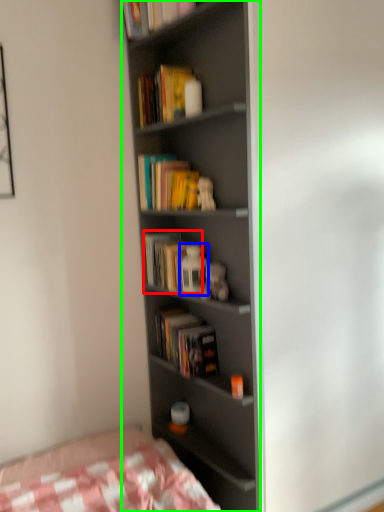
Question: Considering the real-world distances, which object is farthest from book (highlighted by a red box)? toy (highlighted by a blue box) or bookcase (highlighted by a green box)?

Choices:
 (A) toy
 (B) bookcase

Answer: (B)